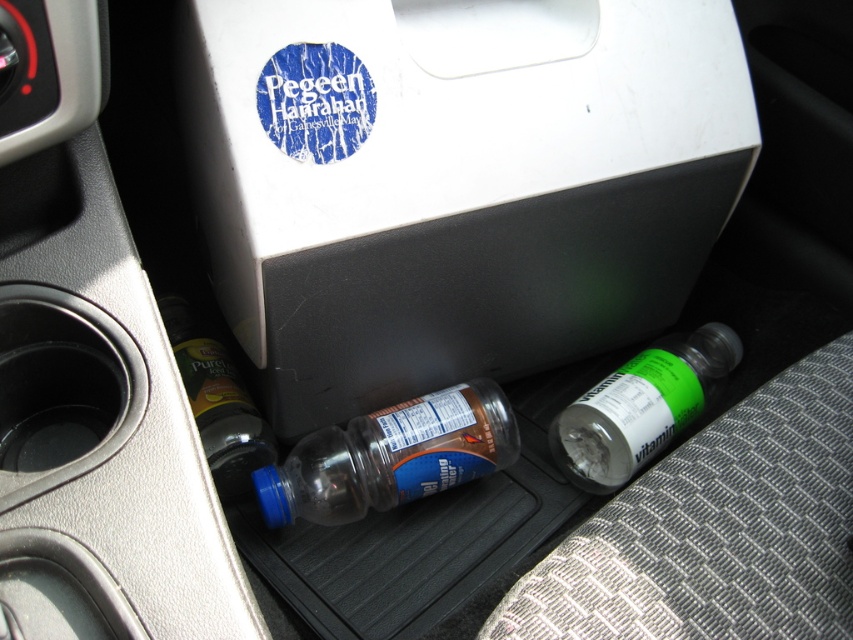
Does green translucent bottle at lower right lie behind translucent plastic bottle at lower left?

Yes, green translucent bottle at lower right is behind translucent plastic bottle at lower left.

Can you confirm if green translucent bottle at lower right is positioned to the right of translucent plastic bottle at lower left?

Indeed, green translucent bottle at lower right is positioned on the right side of translucent plastic bottle at lower left.

Is point (634, 385) positioned in front of point (225, 422)?

No, it is not.

You are a GUI agent. You are given a task and a screenshot of the screen. Output one action in this format:
    pyautogui.click(x=<x>, y=<y>)
    Task: Click on the green translucent bottle at lower right
    The width and height of the screenshot is (853, 640).
    Given the screenshot: What is the action you would take?
    pyautogui.click(x=641, y=406)

Does white matte box at center appear over green translucent bottle at lower right?

Yes.

Is point (363, 189) positioned in front of point (607, 481)?

Yes, it is.

Find the location of a particular element. Image resolution: width=853 pixels, height=640 pixels. white matte box at center is located at coordinates (456, 182).

Which is above, transparent plastic bottle at center or green translucent bottle at lower right?

Positioned higher is green translucent bottle at lower right.

Looking at this image, does transparent plastic bottle at center appear over green translucent bottle at lower right?

Actually, transparent plastic bottle at center is below green translucent bottle at lower right.

Who is more forward, [315,458] or [569,454]?

Point [315,458] is more forward.

Where is `transparent plastic bottle at center`? transparent plastic bottle at center is located at coordinates (392, 456).